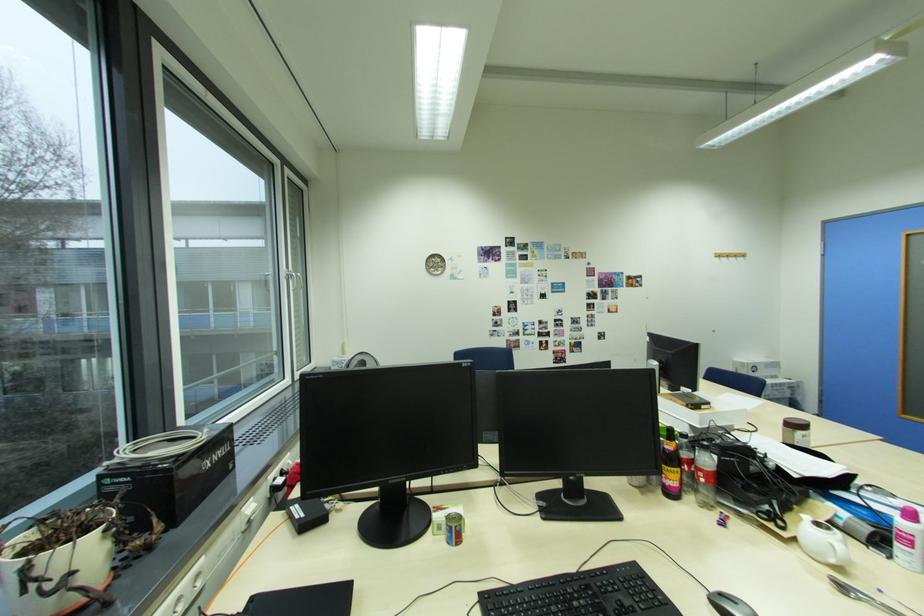
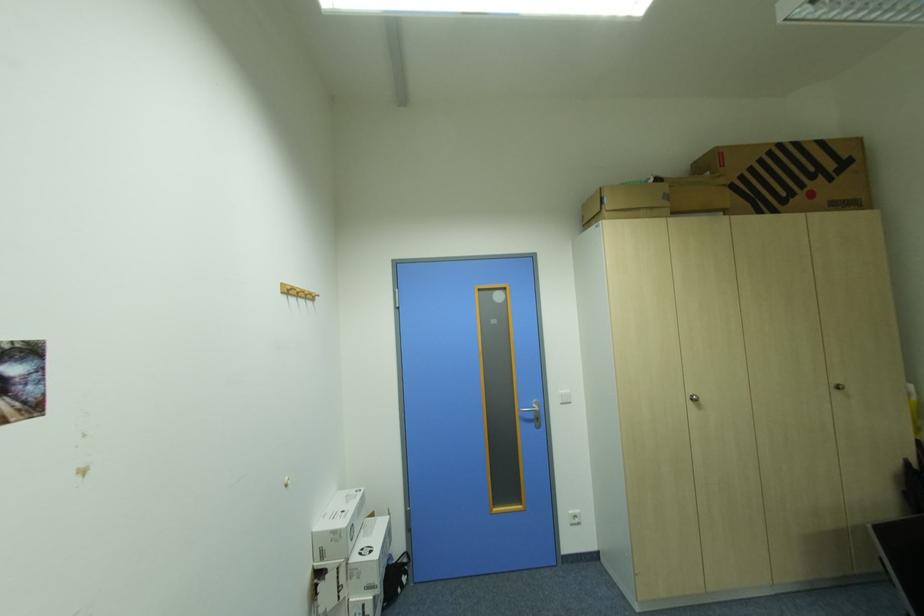
Locate, in the second image, the point that corresponds to (x=749, y=363) in the first image.

(341, 533)